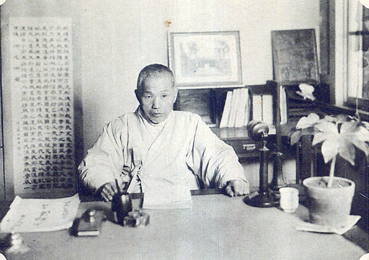
I want to click on black pot, so click(x=121, y=199).